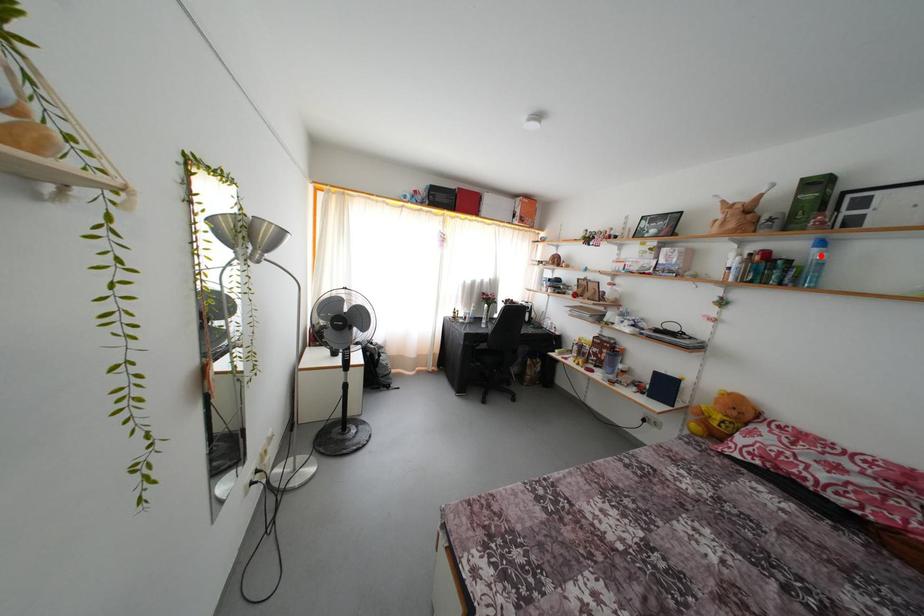
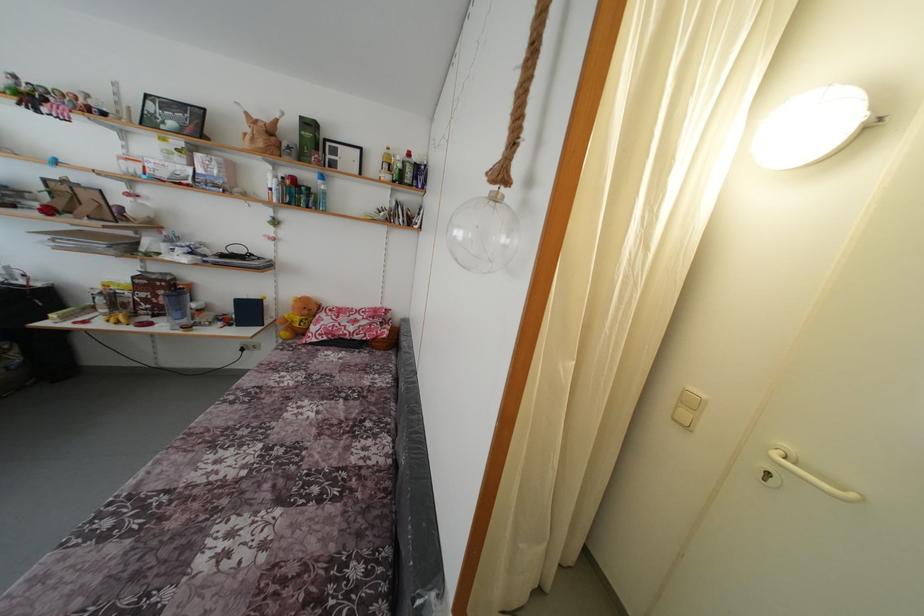
Find the pixel in the second image that matches the highlighted location in the first image.

(324, 188)